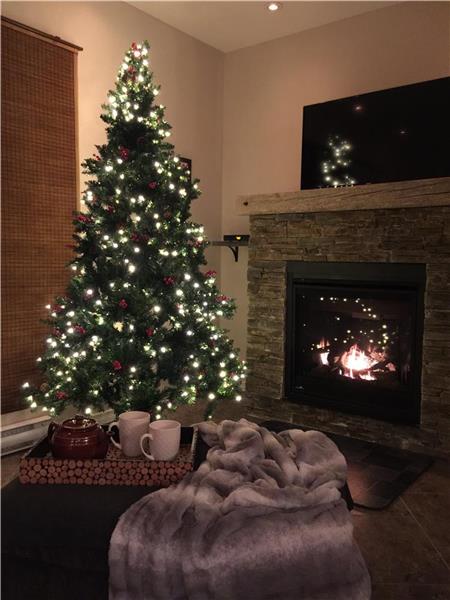
Locate an element on the screen. blanket is located at coordinates (276, 482).